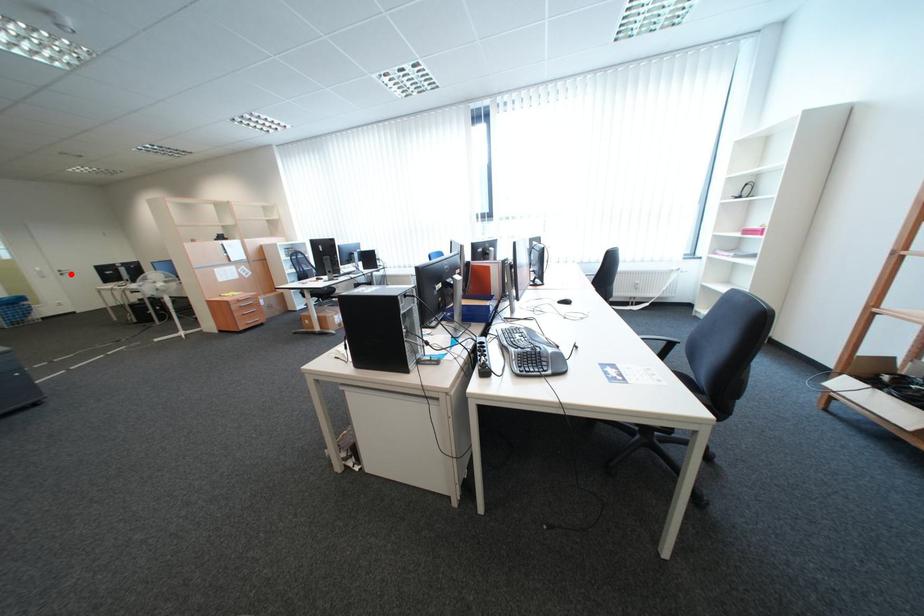
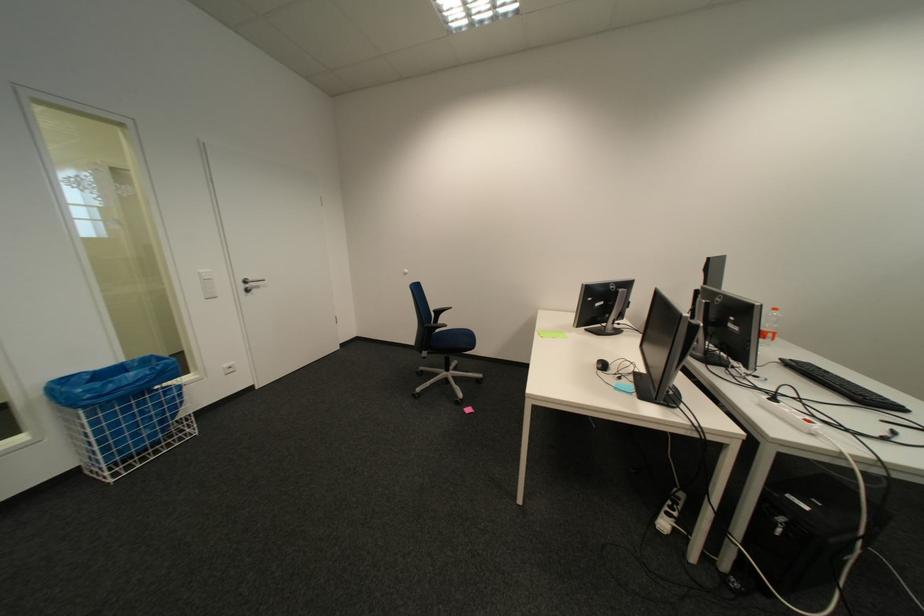
Where in the second image is the point corresponding to the highlighted location from the first image?

(254, 286)